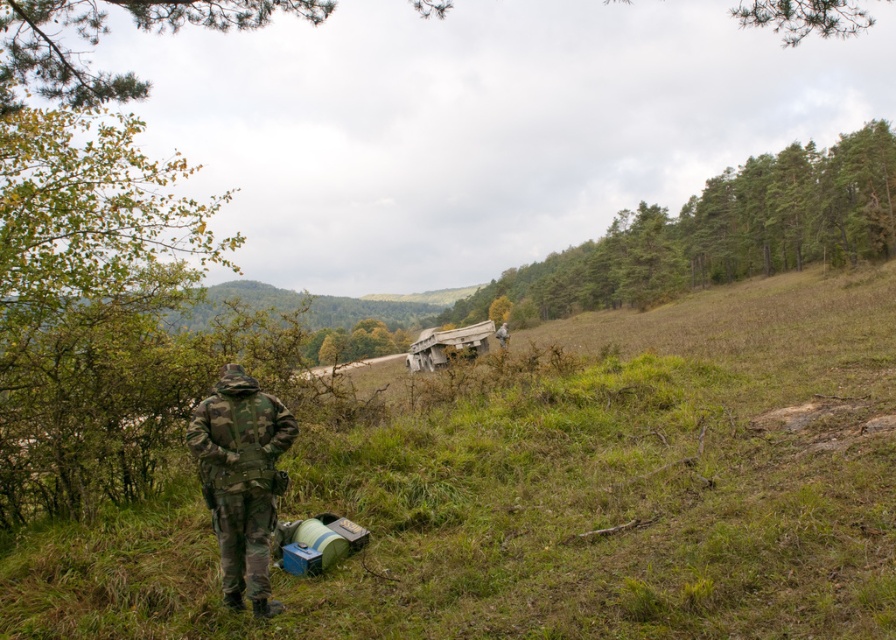
Can you confirm if green grassy at center is positioned below camouflage fabric soldier at center?

Yes.

Does green grassy at center come behind camouflage fabric soldier at center?

That is False.

Is point (362, 627) in front of point (504, 342)?

Yes, point (362, 627) is closer to viewer.

I want to click on green grassy at center, so click(554, 490).

Is point (457, 408) closer to camera compared to point (281, 420)?

No, it is behind (281, 420).

Does point (446, 547) lie in front of point (243, 442)?

No, it is not.

Where is `green grassy at center`? This screenshot has height=640, width=896. green grassy at center is located at coordinates (554, 490).

Looking at this image, which of these two, camouflage fabric uniform at lower left or camouflage fabric soldier at center, stands taller?

camouflage fabric uniform at lower left

Which is behind, point (286, 419) or point (503, 330)?

The point (503, 330) is behind.

Where is `camouflage fabric uniform at lower left`? The width and height of the screenshot is (896, 640). camouflage fabric uniform at lower left is located at coordinates (240, 480).